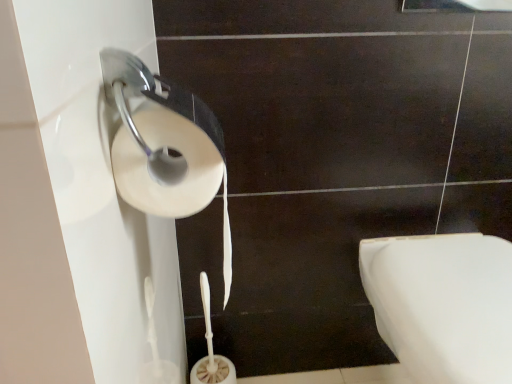
Question: Is white matte toilet paper at left oriented away from white glossy toilet at lower right?

Choices:
 (A) yes
 (B) no

Answer: (B)

Question: Does white matte toilet paper at left have a lesser height compared to white glossy toilet at lower right?

Choices:
 (A) no
 (B) yes

Answer: (B)

Question: Is white matte toilet paper at left wider than white glossy toilet at lower right?

Choices:
 (A) yes
 (B) no

Answer: (B)

Question: Does white matte toilet paper at left have a lesser width compared to white glossy toilet at lower right?

Choices:
 (A) no
 (B) yes

Answer: (B)

Question: Is white matte toilet paper at left not within white glossy toilet at lower right?

Choices:
 (A) yes
 (B) no

Answer: (A)

Question: From the image's perspective, is white matte toilet paper at left over white glossy toilet at lower right?

Choices:
 (A) no
 (B) yes

Answer: (B)

Question: Is white glossy toilet at lower right thinner than white matte toilet paper at left?

Choices:
 (A) no
 (B) yes

Answer: (A)

Question: Does white glossy toilet at lower right come behind white matte toilet paper at left?

Choices:
 (A) no
 (B) yes

Answer: (B)

Question: Is white glossy toilet at lower right taller than white matte toilet paper at left?

Choices:
 (A) no
 (B) yes

Answer: (B)

Question: Is white glossy toilet at lower right aimed at white matte toilet paper at left?

Choices:
 (A) yes
 (B) no

Answer: (B)

Question: Can white matte toilet paper at left be found inside white glossy toilet at lower right?

Choices:
 (A) no
 (B) yes

Answer: (A)

Question: Can you confirm if white glossy toilet at lower right is positioned to the right of white matte toilet paper at left?

Choices:
 (A) no
 (B) yes

Answer: (B)

Question: Is white matte toilet paper at left bigger or smaller than white glossy toilet at lower right?

Choices:
 (A) big
 (B) small

Answer: (B)